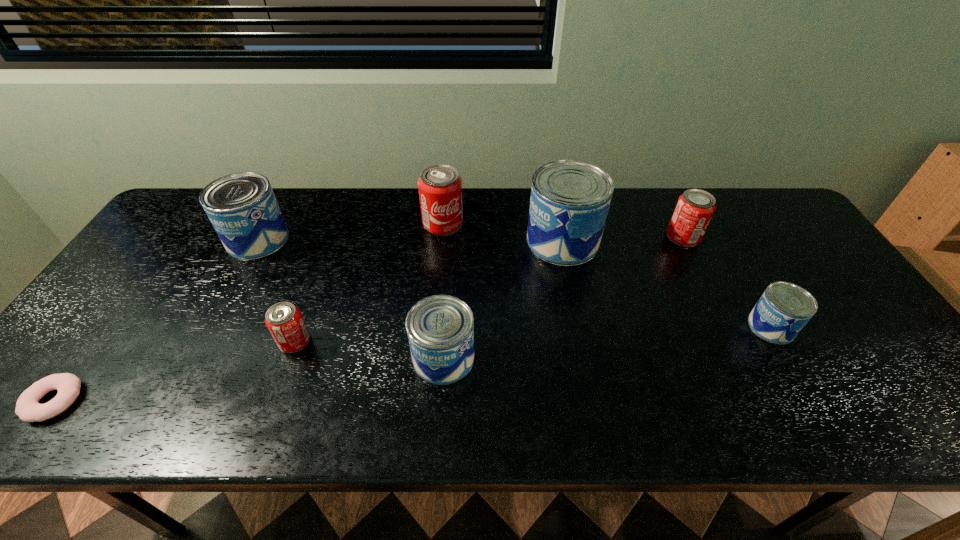
Find the location of a particular element. The image size is (960, 540). the tallest can is located at coordinates (570, 199).

Find the location of a particular element. The height and width of the screenshot is (540, 960). the biggest blue can is located at coordinates (570, 199).

The width and height of the screenshot is (960, 540). Identify the location of the second red can from left to right. (440, 186).

The width and height of the screenshot is (960, 540). Find the location of `the leftmost can`. the leftmost can is located at coordinates (242, 207).

Where is `the second biggest blue can`? The width and height of the screenshot is (960, 540). the second biggest blue can is located at coordinates (242, 207).

Where is `the rightmost red can`? This screenshot has height=540, width=960. the rightmost red can is located at coordinates (695, 207).

Locate an element on the screen. the second smallest red can is located at coordinates (695, 207).

Where is `the second blue can from left to right`? The width and height of the screenshot is (960, 540). the second blue can from left to right is located at coordinates (440, 328).

Locate an element on the screen. This screenshot has width=960, height=540. the smallest red can is located at coordinates (284, 321).

Find the location of a particular element. the second can from left to right is located at coordinates (284, 321).